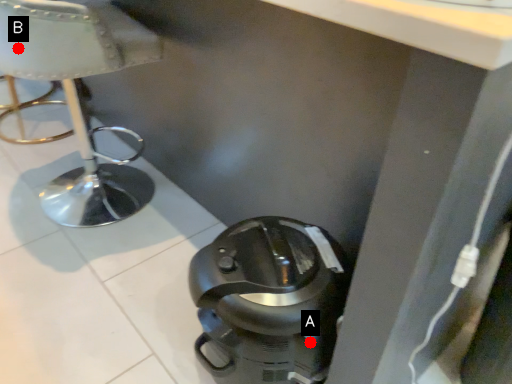
Question: Two points are circled on the image, labeled by A and B beside each circle. Which point is farther to the camera?

Choices:
 (A) A is further
 (B) B is further

Answer: (B)